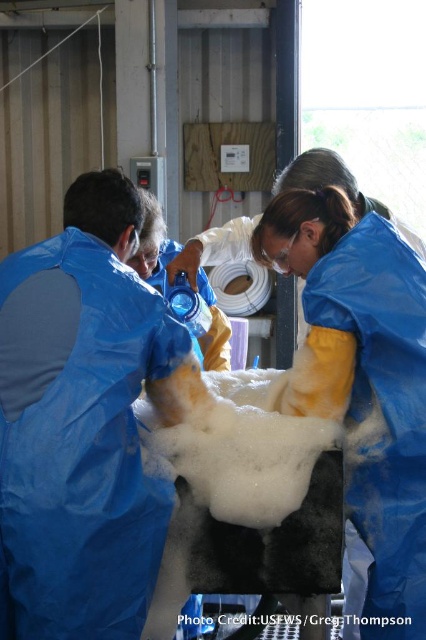
Question: From the image, what is the correct spatial relationship of blue plastic bag at left in relation to blue protective suit at center?

Choices:
 (A) above
 (B) below

Answer: (A)

Question: From the image, what is the correct spatial relationship of blue plastic bag at left in relation to blue protective suit at center?

Choices:
 (A) below
 (B) above

Answer: (B)

Question: Among these objects, which one is nearest to the camera?

Choices:
 (A) blue protective suit at center
 (B) blue plastic bag at left

Answer: (B)

Question: Among these objects, which one is farthest from the camera?

Choices:
 (A) blue plastic bag at left
 (B) blue protective suit at center

Answer: (B)

Question: Does blue plastic bag at left appear on the right side of blue protective suit at center?

Choices:
 (A) no
 (B) yes

Answer: (A)